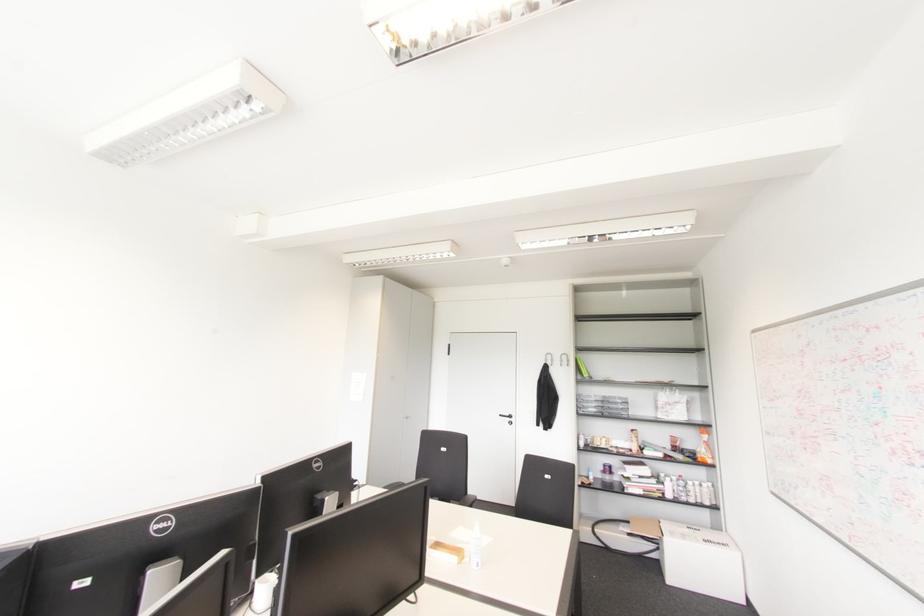
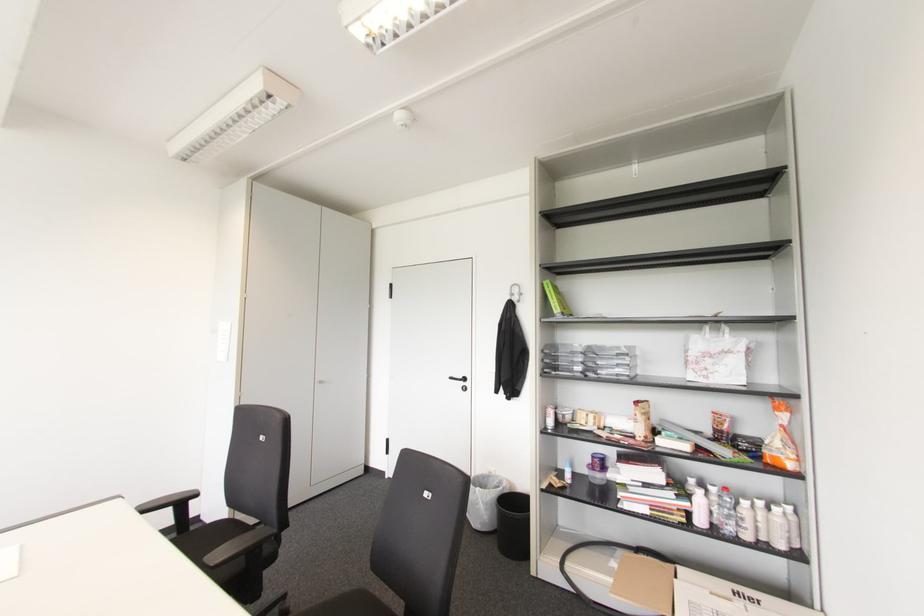
Where in the second image is the point corresponding to [667,495] from the first image?

(699, 521)